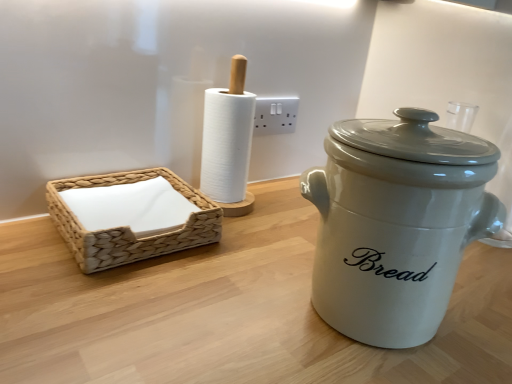
Question: Is white plastic electric outlet at center wider or thinner than white ceramic crock pot at right?

Choices:
 (A) wide
 (B) thin

Answer: (B)

Question: From a real-world perspective, is white plastic electric outlet at center above or below white ceramic crock pot at right?

Choices:
 (A) below
 (B) above

Answer: (B)

Question: Which object is the closest to the white plastic electric outlet at center?

Choices:
 (A) white ceramic crock pot at right
 (B) woven beige basket at left

Answer: (B)

Question: Which object is the farthest from the white plastic electric outlet at center?

Choices:
 (A) woven beige basket at left
 (B) white ceramic crock pot at right

Answer: (B)